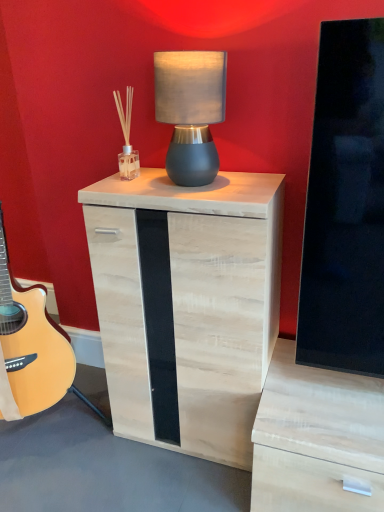
Find the location of `matte gray lampshade at center`. matte gray lampshade at center is located at coordinates (190, 111).

This screenshot has height=512, width=384. What do you see at coordinates (190, 111) in the screenshot?
I see `matte gray lampshade at center` at bounding box center [190, 111].

In order to face natural wood nightstand at center, should I rotate leftwards or rightwards?

Rotate left and turn 0.254 degrees.

This screenshot has width=384, height=512. What do you see at coordinates (187, 305) in the screenshot?
I see `natural wood nightstand at center` at bounding box center [187, 305].

Where is `natural wood nightstand at center`? The height and width of the screenshot is (512, 384). natural wood nightstand at center is located at coordinates (187, 305).

Image resolution: width=384 pixels, height=512 pixels. In order to click on matte gray lampshade at center in this screenshot , I will do `click(190, 111)`.

Looking at this image, which object is positioned more to the right, natural wood nightstand at center or matte gray lampshade at center?

matte gray lampshade at center is more to the right.

Is natural wood nightstand at center positioned behind matte gray lampshade at center?

Yes, the depth of natural wood nightstand at center is greater than that of matte gray lampshade at center.

Is point (168, 261) positioned before point (214, 78)?

No, (168, 261) is behind (214, 78).

From the image's perspective, is natural wood nightstand at center below matte gray lampshade at center?

Yes, from the image's perspective, natural wood nightstand at center is beneath matte gray lampshade at center.

From a real-world perspective, is natural wood nightstand at center over matte gray lampshade at center?

No, from a real-world perspective, natural wood nightstand at center is not over matte gray lampshade at center

From the picture: Considering the sizes of objects natural wood nightstand at center and matte gray lampshade at center in the image provided, who is thinner, natural wood nightstand at center or matte gray lampshade at center?

matte gray lampshade at center.

Considering the sizes of natural wood nightstand at center and matte gray lampshade at center in the image, is natural wood nightstand at center taller or shorter than matte gray lampshade at center?

In the image, natural wood nightstand at center appears to be taller than matte gray lampshade at center.

Is natural wood nightstand at center smaller than matte gray lampshade at center?

No, natural wood nightstand at center is not smaller than matte gray lampshade at center.

Can matte gray lampshade at center be found inside natural wood nightstand at center?

No, matte gray lampshade at center is not inside natural wood nightstand at center.

Is natural wood nightstand at center in contact with matte gray lampshade at center?

No, natural wood nightstand at center is not in contact with matte gray lampshade at center.

Is natural wood nightstand at center turned away from matte gray lampshade at center?

No, natural wood nightstand at center is not facing the opposite direction of matte gray lampshade at center.

How many degrees apart are the facing directions of natural wood nightstand at center and matte gray lampshade at center?

The facing directions of natural wood nightstand at center and matte gray lampshade at center are 2.67 degrees apart.

Based on the photo, how much distance is there between natural wood nightstand at center and matte gray lampshade at center?

natural wood nightstand at center is 34.76 centimeters away from matte gray lampshade at center.

The width and height of the screenshot is (384, 512). I want to click on table lamp located in front of the natural wood nightstand at center, so click(x=190, y=111).

Which is more to the right, matte gray lampshade at center or natural wood nightstand at center?

From the viewer's perspective, matte gray lampshade at center appears more on the right side.

Does matte gray lampshade at center come behind natural wood nightstand at center?

That is False.

Which point is more distant from viewer, (195, 80) or (94, 206)?

Positioned behind is point (94, 206).

From the image's perspective, is matte gray lampshade at center located above natural wood nightstand at center?

Yes.

From a real-world perspective, which is physically below, matte gray lampshade at center or natural wood nightstand at center?

natural wood nightstand at center, from a real-world perspective.

Considering the relative sizes of matte gray lampshade at center and natural wood nightstand at center in the image provided, is matte gray lampshade at center thinner than natural wood nightstand at center?

Correct, the width of matte gray lampshade at center is less than that of natural wood nightstand at center.

Considering the sizes of objects matte gray lampshade at center and natural wood nightstand at center in the image provided, who is shorter, matte gray lampshade at center or natural wood nightstand at center?

matte gray lampshade at center.

Considering the sizes of objects matte gray lampshade at center and natural wood nightstand at center in the image provided, who is smaller, matte gray lampshade at center or natural wood nightstand at center?

With smaller size is matte gray lampshade at center.

Is matte gray lampshade at center inside or outside of natural wood nightstand at center?

matte gray lampshade at center is not enclosed by natural wood nightstand at center.

Is matte gray lampshade at center placed right next to natural wood nightstand at center?

matte gray lampshade at center and natural wood nightstand at center are not in contact.

Consider the image. Is matte gray lampshade at center facing towards natural wood nightstand at center?

No, matte gray lampshade at center is not turned towards natural wood nightstand at center.

Locate an element on the screen. The height and width of the screenshot is (512, 384). table lamp on the right of natural wood nightstand at center is located at coordinates (190, 111).

What are the coordinates of `nightstand behind the matte gray lampshade at center` in the screenshot? It's located at pyautogui.click(x=187, y=305).

Identify the location of nightstand beneath the matte gray lampshade at center (from a real-world perspective). The height and width of the screenshot is (512, 384). (187, 305).